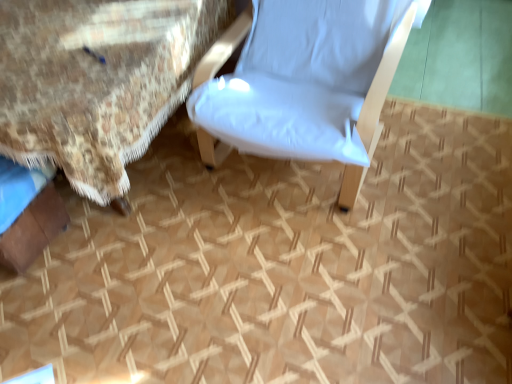
Question: Is white fabric chair at center at the left side of floral fabric bed at center?

Choices:
 (A) yes
 (B) no

Answer: (B)

Question: Does white fabric chair at center have a lesser width compared to floral fabric bed at center?

Choices:
 (A) no
 (B) yes

Answer: (B)

Question: Is white fabric chair at center shorter than floral fabric bed at center?

Choices:
 (A) no
 (B) yes

Answer: (A)

Question: Is white fabric chair at center completely or partially outside of floral fabric bed at center?

Choices:
 (A) yes
 (B) no

Answer: (A)

Question: Can you see white fabric chair at center touching floral fabric bed at center?

Choices:
 (A) yes
 (B) no

Answer: (B)

Question: From a real-world perspective, is white fabric chair at center located higher than floral fabric bed at center?

Choices:
 (A) yes
 (B) no

Answer: (A)

Question: Is floral fabric bed at center beside white fabric chair at center?

Choices:
 (A) yes
 (B) no

Answer: (B)

Question: From the image's perspective, is floral fabric bed at center beneath white fabric chair at center?

Choices:
 (A) yes
 (B) no

Answer: (A)

Question: Would you say floral fabric bed at center is a long distance from white fabric chair at center?

Choices:
 (A) no
 (B) yes

Answer: (A)

Question: Does floral fabric bed at center have a greater height compared to white fabric chair at center?

Choices:
 (A) no
 (B) yes

Answer: (A)

Question: Is floral fabric bed at center positioned with its back to white fabric chair at center?

Choices:
 (A) yes
 (B) no

Answer: (B)

Question: From a real-world perspective, is floral fabric bed at center located higher than white fabric chair at center?

Choices:
 (A) no
 (B) yes

Answer: (A)

Question: Considering their positions, is floral fabric bed at center located in front of or behind white fabric chair at center?

Choices:
 (A) front
 (B) behind

Answer: (B)